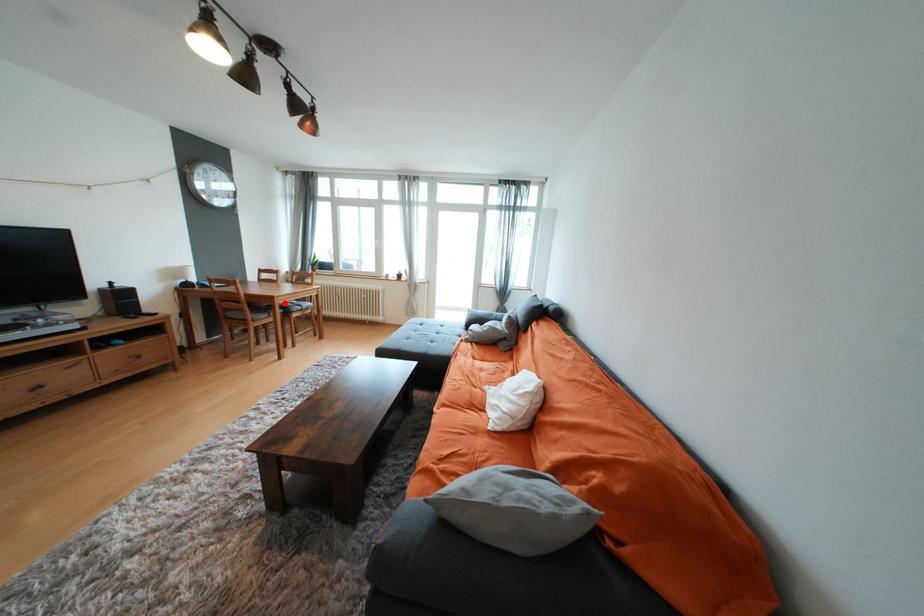
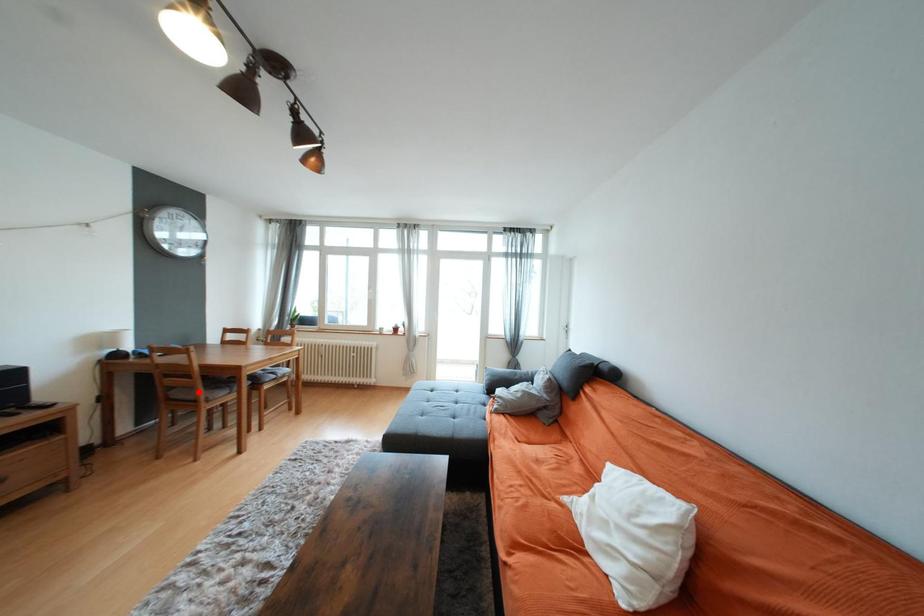
I am providing you with two images of the same scene from different viewpoints. A red point is marked on the first image and another point is marked on the second image. Do the highlighted points in image1 and image2 indicate the same real-world spot?

No